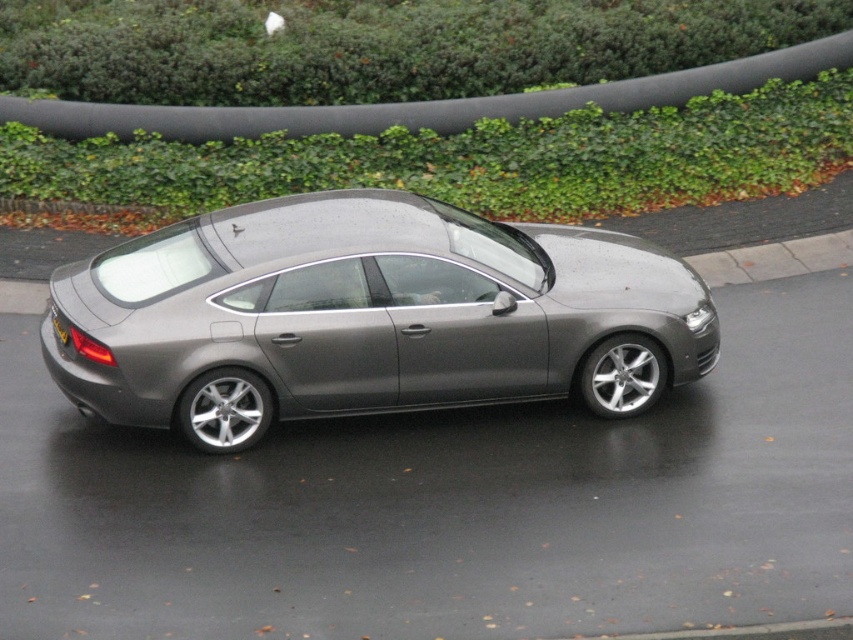
Question: Which of the following is the closest to the observer?

Choices:
 (A) (349, 374)
 (B) (51, 314)

Answer: (A)

Question: Does satin metallic car at center appear on the right side of yellow plastic license plate at rear?

Choices:
 (A) yes
 (B) no

Answer: (A)

Question: From the image, what is the correct spatial relationship of satin metallic car at center in relation to yellow plastic license plate at rear?

Choices:
 (A) left
 (B) right

Answer: (B)

Question: Which point is closer to the camera taking this photo?

Choices:
 (A) (177, 397)
 (B) (57, 328)

Answer: (A)

Question: Is satin metallic car at center above yellow plastic license plate at rear?

Choices:
 (A) yes
 (B) no

Answer: (A)